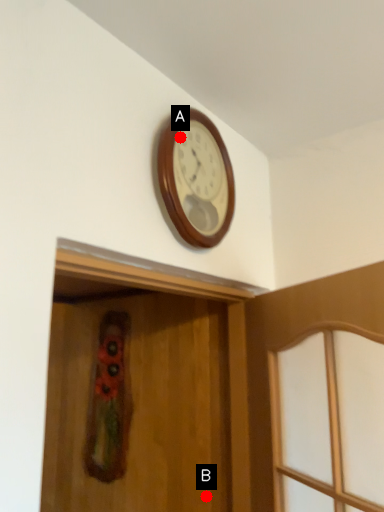
Question: Two points are circled on the image, labeled by A and B beside each circle. Which point is farther to the camera?

Choices:
 (A) A is further
 (B) B is further

Answer: (B)